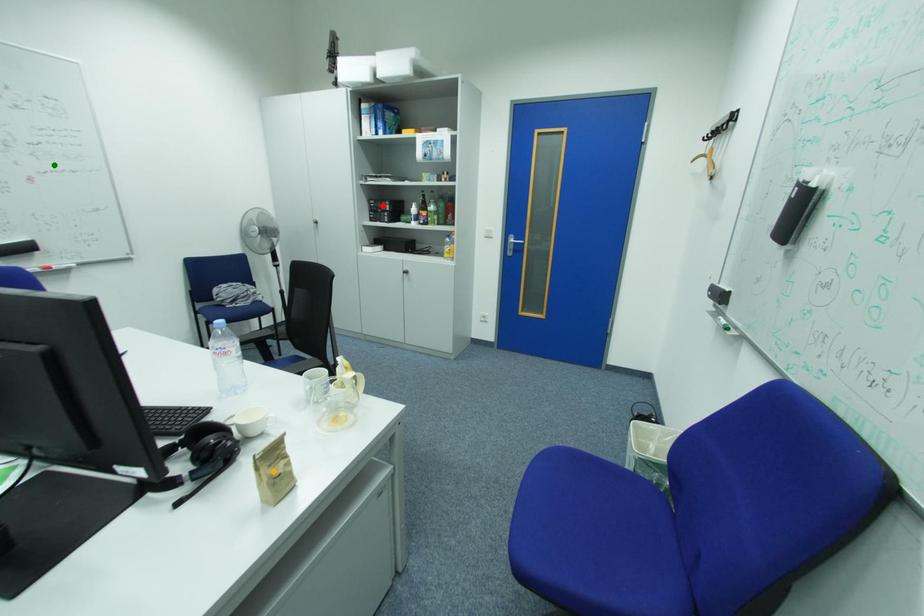
Order these from farthest to nearest:
A) orange point
B) red point
C) green point

red point < green point < orange point